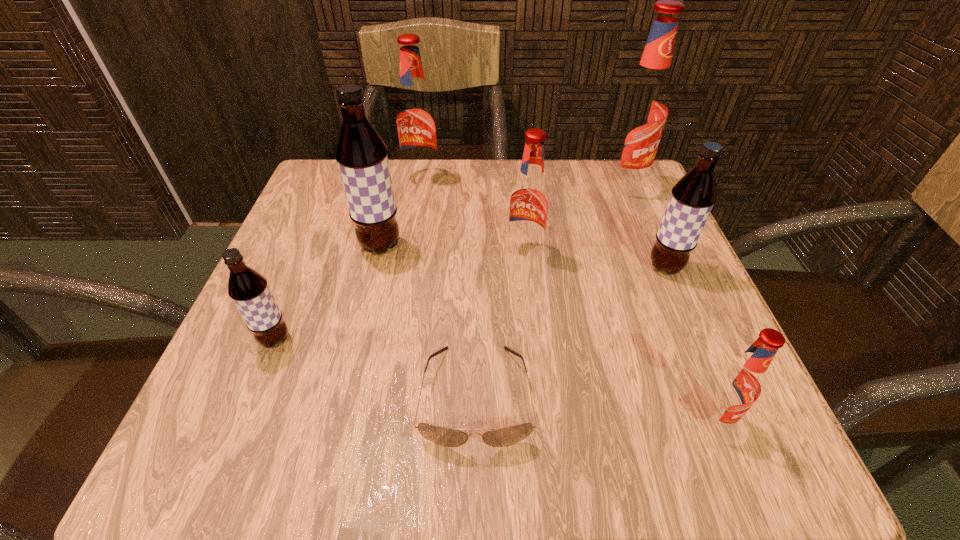
Locate an element on the screen. Image resolution: width=960 pixels, height=540 pixels. the nearest red root beer is located at coordinates (738, 384).

The height and width of the screenshot is (540, 960). What are the coordinates of `the shortest object` in the screenshot? It's located at (502, 437).

Where is `vacant region located 0.120m on the front of the tallest object`? vacant region located 0.120m on the front of the tallest object is located at coordinates (642, 234).

The image size is (960, 540). I want to click on free region located on the right of the second biggest red root beer, so click(493, 179).

Locate an element on the screen. free spot located 0.130m on the left of the biggest brown root beer is located at coordinates (290, 246).

Locate an element on the screen. The height and width of the screenshot is (540, 960). vacant region located 0.260m on the back of the fourth root beer from right to left is located at coordinates (516, 168).

The height and width of the screenshot is (540, 960). I want to click on vacant space located 0.290m on the back of the second biggest brown root beer, so click(624, 171).

This screenshot has height=540, width=960. I want to click on free spot located on the back of the leftmost brown root beer, so click(326, 213).

Locate an element on the screen. Image resolution: width=960 pixels, height=540 pixels. free spot located on the back of the smallest red root beer is located at coordinates (681, 338).

This screenshot has height=540, width=960. Identify the location of root beer that is at the near edge. (738, 384).